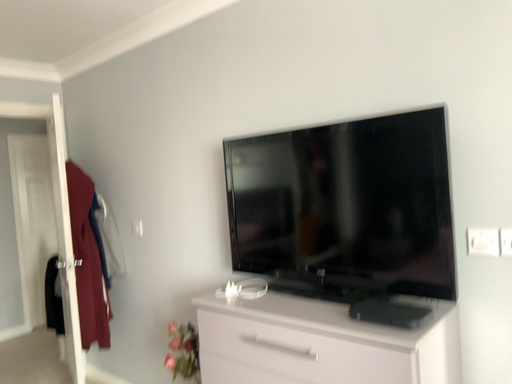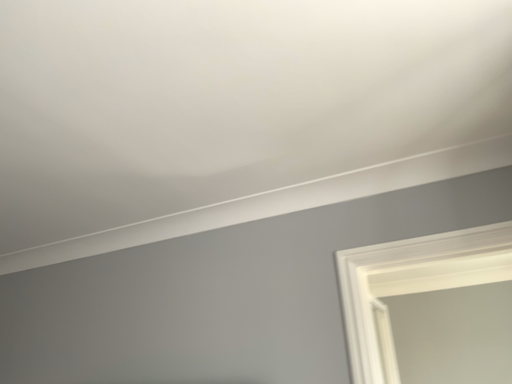
Question: How did the camera likely rotate when shooting the video?

Choices:
 (A) rotated upward
 (B) rotated downward

Answer: (A)